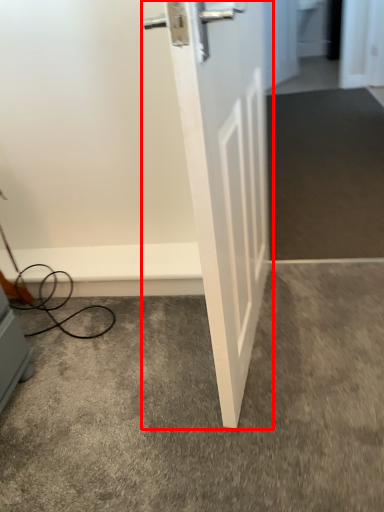
Question: From the image's perspective, where is door (annotated by the red box) located in relation to concrete in the image?

Choices:
 (A) above
 (B) below

Answer: (A)